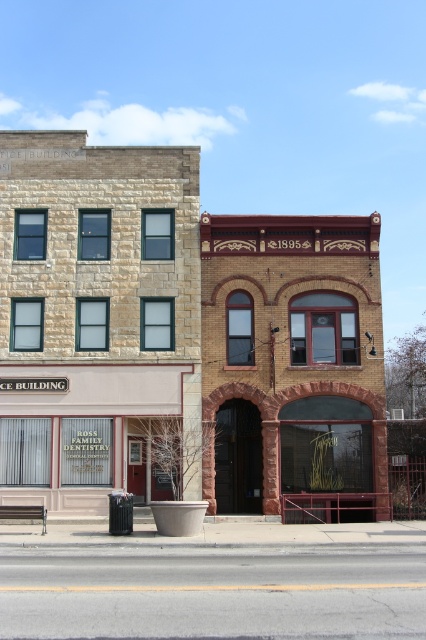
Question: Which point is closer to the camera?

Choices:
 (A) click(31, 404)
 (B) click(316, 248)
 (C) click(207, 426)

Answer: (C)

Question: Does brown brick building at center come in front of beige stone storefront at center?

Choices:
 (A) yes
 (B) no

Answer: (A)

Question: Which object is the closest to the beige stone storefront at center?

Choices:
 (A) brown brick building at center
 (B) stone building at center

Answer: (B)

Question: Which object appears farthest from the camera in this image?

Choices:
 (A) brown brick building at center
 (B) beige stone storefront at center
 (C) stone building at center

Answer: (B)

Question: Where is brown brick building at center located in relation to beige stone storefront at center in the image?

Choices:
 (A) left
 (B) right

Answer: (B)

Question: Does stone building at center have a greater width compared to brown brick building at center?

Choices:
 (A) no
 (B) yes

Answer: (B)